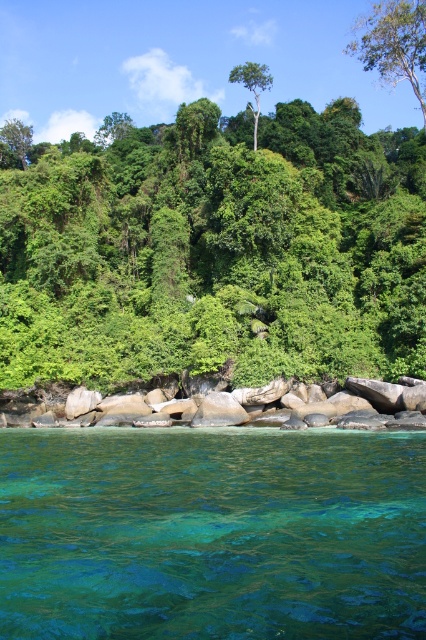
Question: Does green leafy tree at center appear on the left side of green smooth tree at center?

Choices:
 (A) no
 (B) yes

Answer: (B)

Question: Which point appears farthest from the camera in this image?

Choices:
 (A) (199, 214)
 (B) (425, 589)
 (C) (371, 394)
 (D) (261, 76)

Answer: (D)

Question: Considering the real-world distances, which object is farthest from the green leafy tree at upper center?

Choices:
 (A) green leafy tree at center
 (B) teal translucent water at lower center
 (C) smooth gray rocks at lower center

Answer: (C)

Question: Observing the image, what is the correct spatial positioning of teal translucent water at lower center in reference to green leafy tree at upper left?

Choices:
 (A) above
 (B) below

Answer: (B)

Question: Is teal translucent water at lower center below green leafy tree at upper left?

Choices:
 (A) no
 (B) yes

Answer: (B)

Question: Among these points, which one is farthest from the camera?

Choices:
 (A) (405, 538)
 (B) (261, 81)
 (C) (14, 140)
 (D) (57, 340)

Answer: (C)